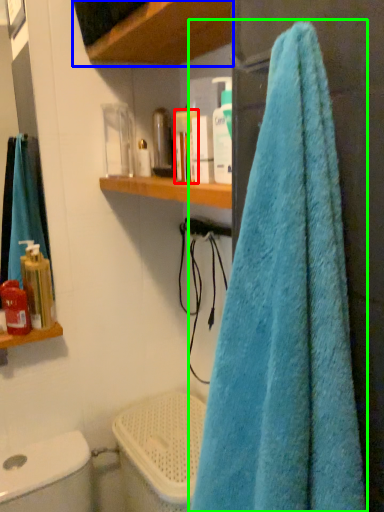
Question: Considering the real-world distances, which object is farthest from toiletry (highlighted by a red box)? shelf (highlighted by a blue box) or towel (highlighted by a green box)?

Choices:
 (A) shelf
 (B) towel

Answer: (B)